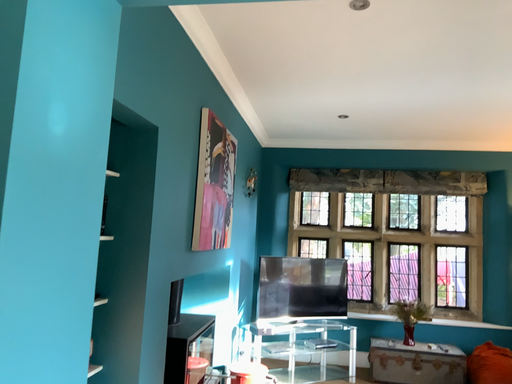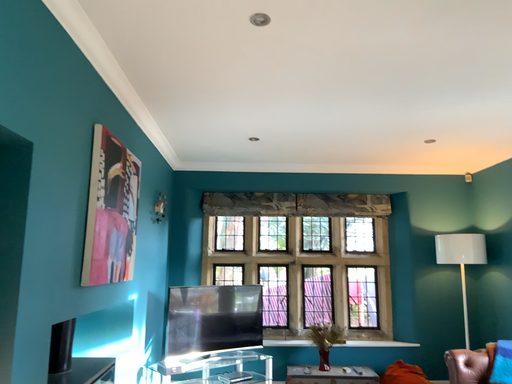
Question: Which way did the camera rotate in the video?

Choices:
 (A) rotated left
 (B) rotated right

Answer: (B)